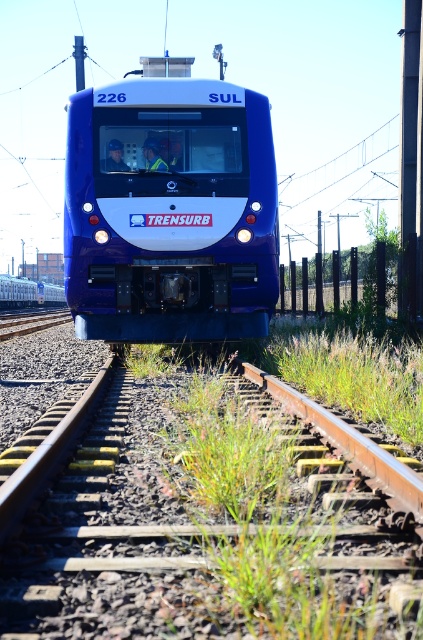
You are standing at the point where the train is approaching. The train is moving directly towards you. There is a rusty metal train track at center represented by point [206,516]. If you want to avoid the train, should you move to the left or right side of the track?

Since the train is moving directly towards you on the rusty metal train track at center represented by point [206,516], you should move to either the left or right side of the track to avoid being hit by the train.

You are standing on the platform waiting for the train to pass. Based on the image, which object is closer to you between the rusty metal train track at center and the matte blue train at center?

The rusty metal train track at center is closer to you since it is positioned in front of the matte blue train at center in the image.